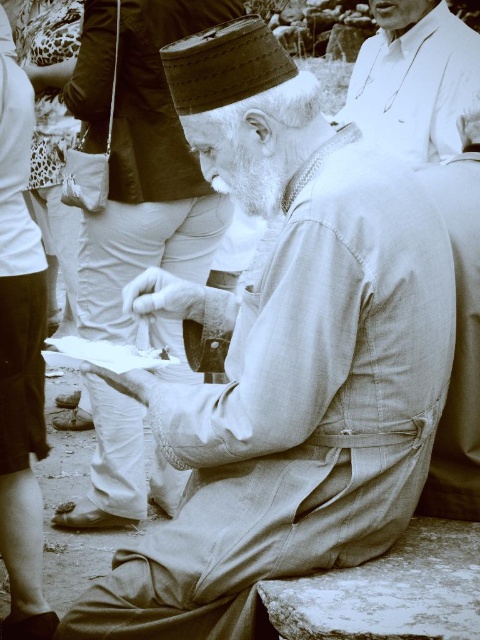
Looking at this image, between textured fabric robe at center and white woolen beard at center, which one has more height?

With more height is textured fabric robe at center.

Is point (133, 502) closer to viewer compared to point (260, 161)?

No, (133, 502) is further to viewer.

The height and width of the screenshot is (640, 480). Identify the location of textured fabric robe at center. (148, 172).

Is white fabric shirt at upper right thinner than light beige fabric at right?

In fact, white fabric shirt at upper right might be wider than light beige fabric at right.

Locate an element on the screen. This screenshot has width=480, height=640. white fabric shirt at upper right is located at coordinates (414, 77).

Identify the location of white fabric shirt at upper right. (414, 77).

Is point (131, 196) positioned behind point (117, 362)?

Yes, it is behind point (117, 362).

Between point (192, 209) and point (154, 368), which one is positioned in front?

Point (154, 368) is in front.

You are a GUI agent. You are given a task and a screenshot of the screen. Output one action in this format:
    pyautogui.click(x=<x>, y=<y>)
    Task: Click on the textured fabric robe at center
    This screenshot has width=480, height=640.
    Given the screenshot: What is the action you would take?
    [148, 172]